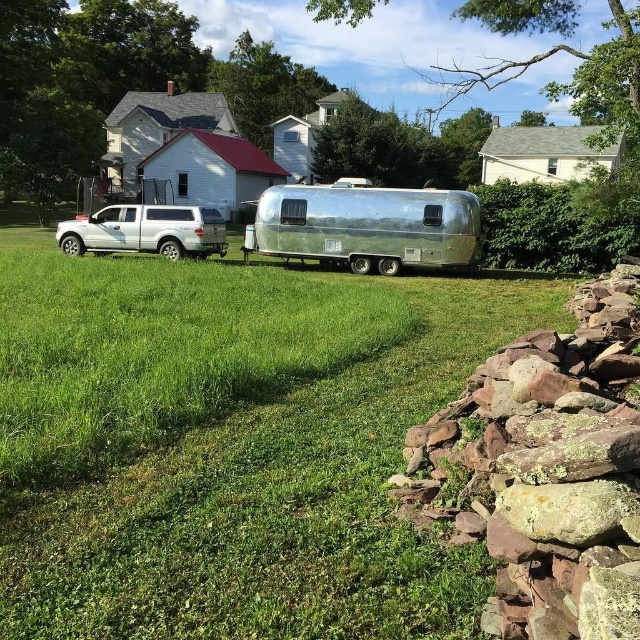
Who is higher up, silver metallic trailer at center or white matte truck at left?

white matte truck at left is above.

Is point (444, 252) in front of point (124, 218)?

That is True.

The image size is (640, 640). What do you see at coordinates (368, 227) in the screenshot?
I see `silver metallic trailer at center` at bounding box center [368, 227].

Identify the location of silver metallic trailer at center. Image resolution: width=640 pixels, height=640 pixels. (368, 227).

Can you confirm if rusty stone wall at lower right is positioned to the right of white matte truck at left?

Correct, you'll find rusty stone wall at lower right to the right of white matte truck at left.

I want to click on rusty stone wall at lower right, so click(545, 472).

Is point (557, 532) in front of point (138, 236)?

Yes, it is in front of point (138, 236).

Locate an element on the screen. The width and height of the screenshot is (640, 640). rusty stone wall at lower right is located at coordinates (545, 472).

How much distance is there between green grass at center and rusty stone wall at lower right?

green grass at center and rusty stone wall at lower right are 6.20 meters apart from each other.

Measure the distance between green grass at center and camera.

A distance of 2.72 meters exists between green grass at center and camera.

The width and height of the screenshot is (640, 640). In order to click on green grass at center in this screenshot , I will do `click(230, 444)`.